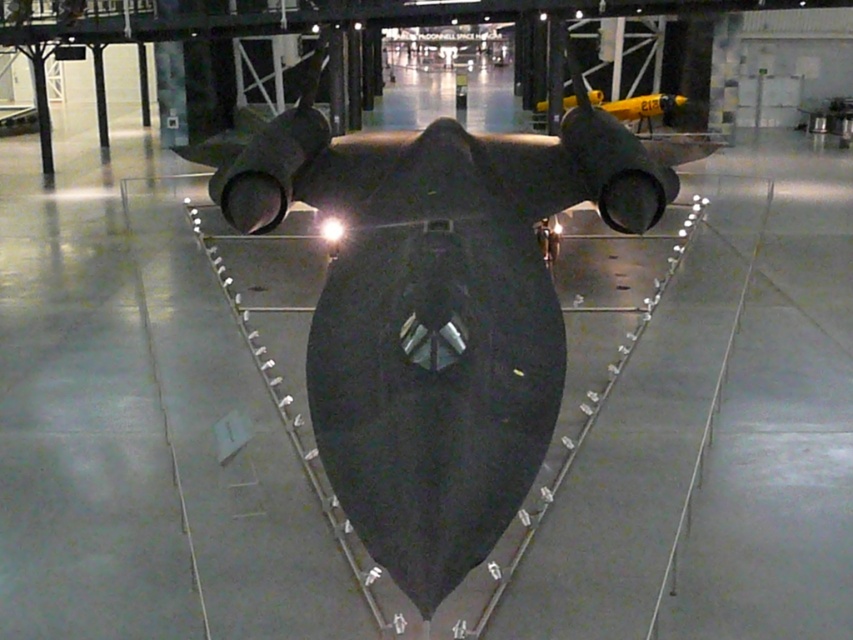
Question: In this image, where is matte black aircraft at center located relative to yellow matte airplane at upper center?

Choices:
 (A) above
 (B) below

Answer: (B)

Question: From the image, what is the correct spatial relationship of matte black aircraft at center in relation to yellow matte airplane at upper center?

Choices:
 (A) above
 (B) below

Answer: (B)

Question: Which point is farther to the camera?

Choices:
 (A) (360, 170)
 (B) (664, 120)

Answer: (B)

Question: Does matte black aircraft at center lie in front of yellow matte airplane at upper center?

Choices:
 (A) yes
 (B) no

Answer: (A)

Question: Which point is closer to the camera?

Choices:
 (A) (238, 202)
 (B) (648, 100)

Answer: (A)